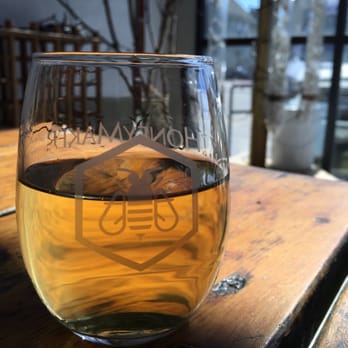
You are a GUI agent. You are given a task and a screenshot of the screen. Output one action in this format:
    pyautogui.click(x=<x>, y=<y>)
    Task: Click on the upper left corner of the table looking through the glass
    The image size is (348, 348).
    Given the screenshot: What is the action you would take?
    pyautogui.click(x=44, y=125)